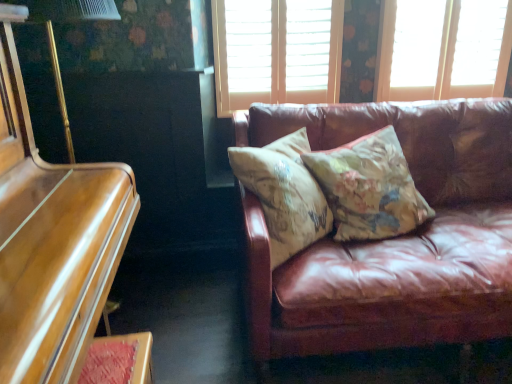
Question: Is shiny brown piano at left spatially inside wooden blinds at upper center, the 2th window viewed from the right, or outside of it?

Choices:
 (A) inside
 (B) outside

Answer: (B)

Question: In the image, is shiny brown piano at left positioned in front of or behind wooden blinds at upper center, acting as the 1th window starting from the left?

Choices:
 (A) behind
 (B) front

Answer: (B)

Question: Which object is positioned farthest from the floral-patterned fabric pillow at center, which is the first pillow in left-to-right order?

Choices:
 (A) matte white window at upper right, which is the 1th window in right-to-left order
 (B) wooden blinds at upper center, acting as the 1th window starting from the left
 (C) shiny brown piano at left
 (D) floral-patterned fabric pillow at center, the second pillow in the left-to-right sequence
 (E) leather couch at right

Answer: (A)

Question: Which is nearer to the floral-patterned fabric pillow at center, the 2th pillow when ordered from right to left?

Choices:
 (A) floral-patterned fabric pillow at center, the second pillow in the left-to-right sequence
 (B) shiny brown piano at left
 (C) wooden blinds at upper center, acting as the 1th window starting from the left
 (D) matte white window at upper right, which is the second window from left to right
 (E) leather couch at right

Answer: (A)